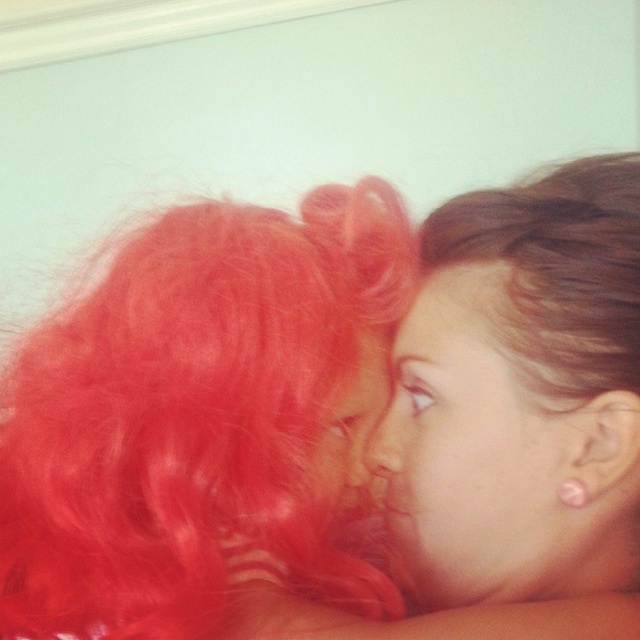
Between bright red hair at center and matte red hair at center, which one appears on the left side from the viewer's perspective?

From the viewer's perspective, bright red hair at center appears more on the left side.

Can you confirm if bright red hair at center is bigger than matte red hair at center?

Yes.

Who is more forward, (83,456) or (364,458)?

Point (83,456)

Locate an element on the screen. The image size is (640, 640). bright red hair at center is located at coordinates coord(195,420).

Is point (490, 600) farther from viewer compared to point (337, 508)?

No, it is not.

Is smooth skin face at center below matte red hair at center?

Yes, smooth skin face at center is below matte red hair at center.

Image resolution: width=640 pixels, height=640 pixels. Find the location of `smooth skin face at center`. smooth skin face at center is located at coordinates (474, 449).

Does bright red hair at center appear on the left side of smooth skin face at center?

Indeed, bright red hair at center is positioned on the left side of smooth skin face at center.

Consider the image. Measure the distance between bright red hair at center and smooth skin face at center.

A distance of 3.81 inches exists between bright red hair at center and smooth skin face at center.

You are a GUI agent. You are given a task and a screenshot of the screen. Output one action in this format:
    pyautogui.click(x=<x>, y=<y>)
    Task: Click on the bright red hair at center
    
    Given the screenshot: What is the action you would take?
    pyautogui.click(x=195, y=420)

Where is `bright red hair at center`? Image resolution: width=640 pixels, height=640 pixels. bright red hair at center is located at coordinates (195, 420).